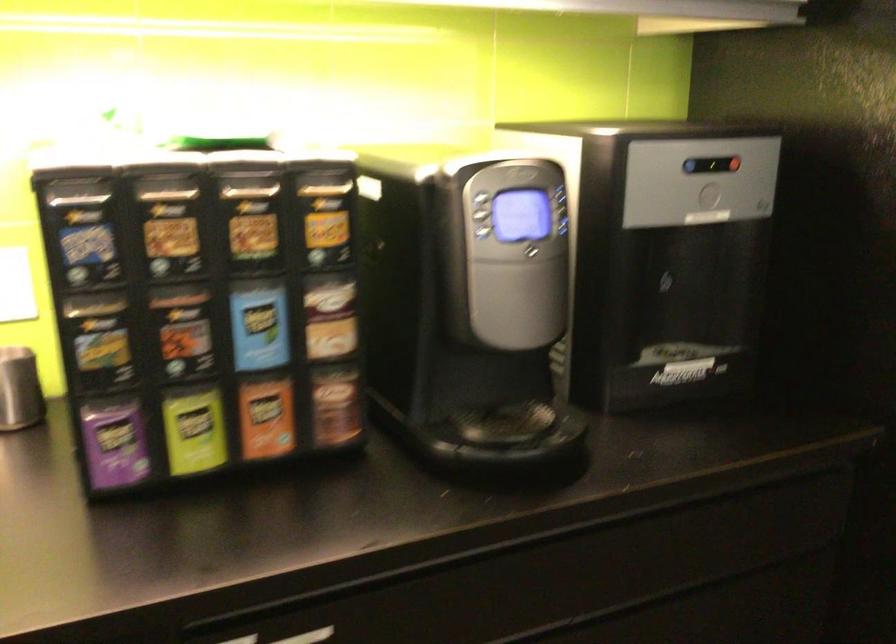
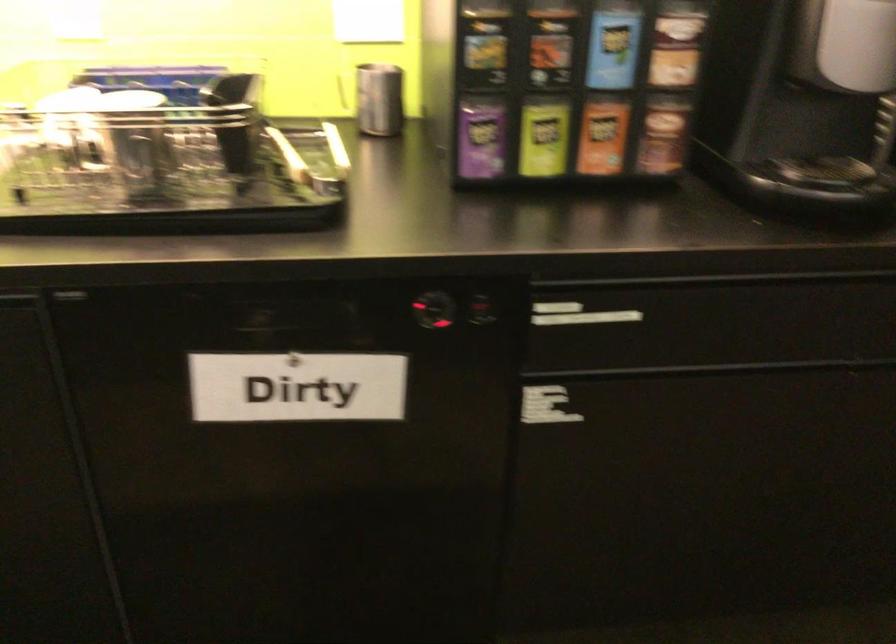
Question: Based on the continuous images, in which direction is the camera rotating? Reply with the corresponding letter.

Choices:
 (A) Left
 (B) Right
 (C) Up
 (D) Down

Answer: (A)